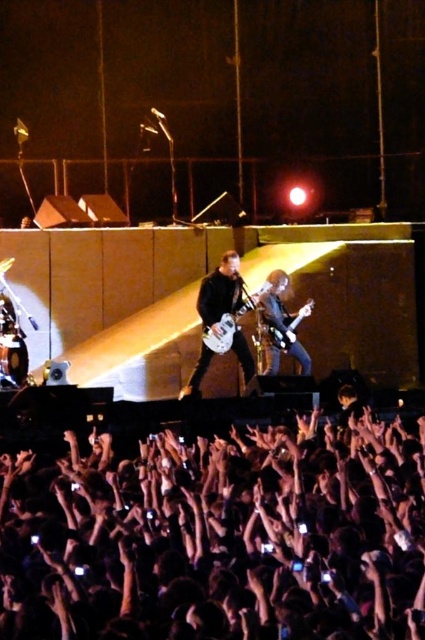
You are a stagehand who needs to place a protective cover over both the shiny black guitar at center and the shiny silver guitar at center. Which guitar requires a larger cover based on their widths?

The shiny black guitar at center might be wider than the shiny silver guitar at center, so it likely requires a larger cover.

You are a photographer at the concert and want to capture the shiny brown guitar at center. Based on its position, which area of the stage should you focus your camera on?

The shiny brown guitar at center is located at point coordinates approximately 0.508 on the horizontal axis and 0.661 on the vertical axis, so you should focus your camera on the central area slightly lower than the middle of the stage.

You are a photographer at the concert and want to capture both the shiny black guitar at center and the shiny silver guitar at center in a single shot. Given that your camera has a focal length of 50mm and the minimum distance between objects in the frame needs to be at least 1.5 meters to avoid blurriness, can you achieve this?

The shiny black guitar at center is 1.57 meters away from the shiny silver guitar at center. Since the minimum required distance is 1.5 meters, the 1.57 meters distance exceeds this requirement. Therefore, you can capture both guitars in a single shot without blurriness.